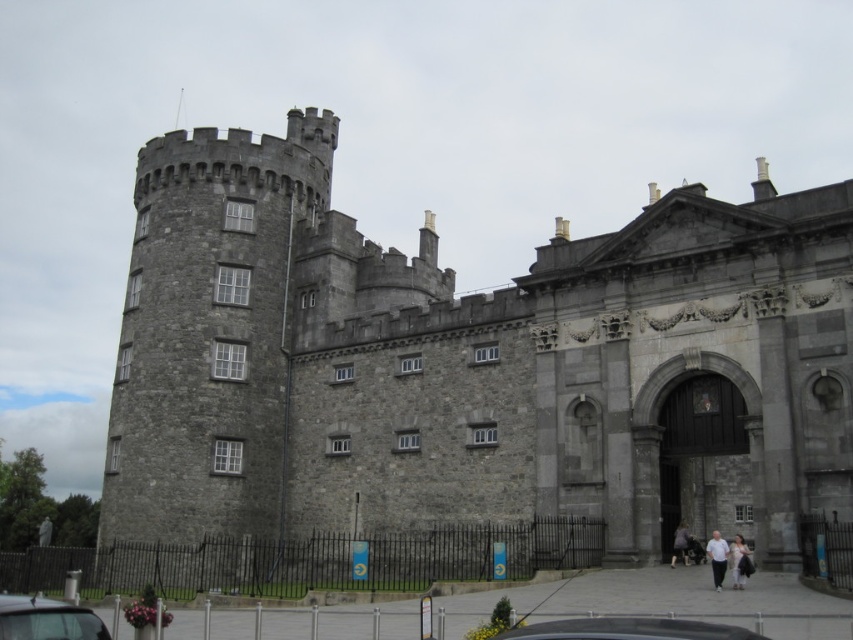
You are an artist sketching the scene of the gray stone castle at left and the dark gray fabric jacket at lower right. Which object should you draw first if you follow the rule of drawing taller objects before shorter ones?

The gray stone castle at left should be drawn first because it has a greater height compared to the dark gray fabric jacket at lower right.

You are standing in a field and see the gray stone castle at left in the distance. If you want to reach the castle within 10 minutes, what is the minimum speed you need to walk at?

The gray stone castle at left is 132.87 feet away. To reach it in 10 minutes, you need to walk at a minimum speed of approximately 2.21 feet per minute.